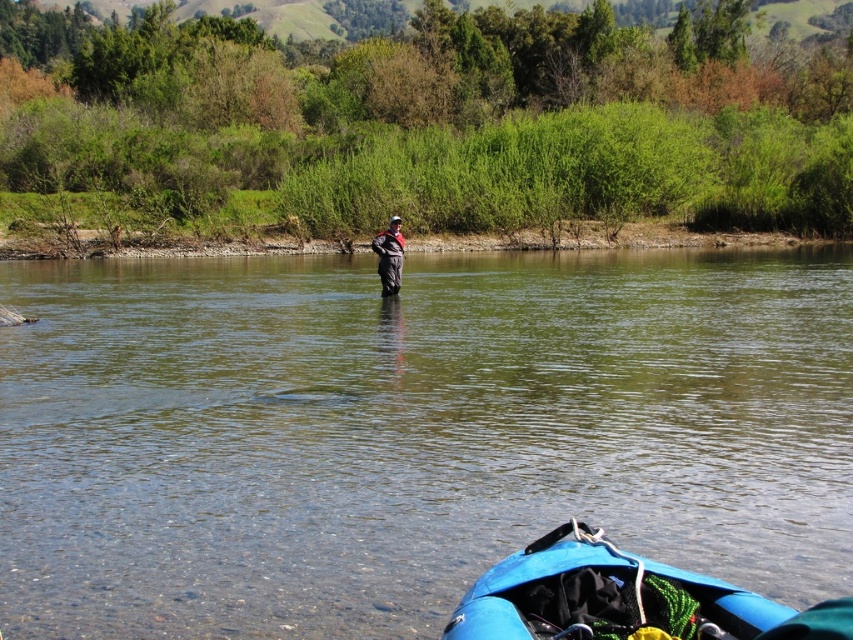
Is point (804, 369) closer to camera compared to point (396, 227)?

That is True.

Is point (552, 499) positioned in front of point (383, 250)?

Yes.

Locate an element on the screen. This screenshot has width=853, height=640. clear water at center is located at coordinates (410, 433).

Which is below, blue rubber canoe at lower center or dark gray waterproof jacket at center?

blue rubber canoe at lower center is lower down.

Who is more distant from viewer, (511, 605) or (386, 244)?

The point (386, 244) is behind.

I want to click on blue rubber canoe at lower center, so click(x=602, y=596).

Does point (100, 337) lie in front of point (497, 630)?

No.

Does clear water at center have a greater width compared to blue rubber canoe at lower center?

Correct, the width of clear water at center exceeds that of blue rubber canoe at lower center.

Which is behind, point (241, 531) or point (566, 529)?

The point (241, 531) is behind.

I want to click on clear water at center, so click(410, 433).